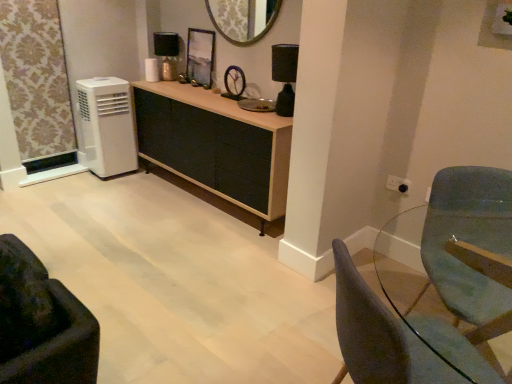
Question: From a real-world perspective, does white plastic air conditioner at left stand above metallic reflective frame at center?

Choices:
 (A) yes
 (B) no

Answer: (B)

Question: From a real-world perspective, is white plastic air conditioner at left under metallic reflective frame at center?

Choices:
 (A) yes
 (B) no

Answer: (A)

Question: Are white plastic air conditioner at left and metallic reflective frame at center making contact?

Choices:
 (A) no
 (B) yes

Answer: (A)

Question: Can you confirm if white plastic air conditioner at left is wider than metallic reflective frame at center?

Choices:
 (A) yes
 (B) no

Answer: (A)

Question: Is the depth of white plastic air conditioner at left less than that of metallic reflective frame at center?

Choices:
 (A) yes
 (B) no

Answer: (A)

Question: Is white plastic air conditioner at left completely or partially outside of metallic reflective frame at center?

Choices:
 (A) no
 (B) yes

Answer: (B)

Question: From a real-world perspective, is velvet dark brown armchair at lower left, the 1th chair in the left-to-right sequence, on top of white plastic air conditioner at left?

Choices:
 (A) yes
 (B) no

Answer: (B)

Question: Is velvet dark brown armchair at lower left, the second chair when ordered from right to left, positioned with its back to white plastic air conditioner at left?

Choices:
 (A) no
 (B) yes

Answer: (A)

Question: Is velvet dark brown armchair at lower left, the 1th chair in the left-to-right sequence, not near white plastic air conditioner at left?

Choices:
 (A) no
 (B) yes

Answer: (B)

Question: From the image's perspective, is velvet dark brown armchair at lower left, the 1th chair in the left-to-right sequence, over white plastic air conditioner at left?

Choices:
 (A) no
 (B) yes

Answer: (A)

Question: Is velvet dark brown armchair at lower left, the second chair when ordered from right to left, oriented towards white plastic air conditioner at left?

Choices:
 (A) no
 (B) yes

Answer: (A)

Question: From the image's perspective, is velvet dark brown armchair at lower left, the second chair when ordered from right to left, beneath white plastic air conditioner at left?

Choices:
 (A) no
 (B) yes

Answer: (B)

Question: Is metallic gold lamp at upper center, the first lamp from the back, oriented away from black matte lamp at upper right, which appears as the first lamp when viewed from the front?

Choices:
 (A) yes
 (B) no

Answer: (B)